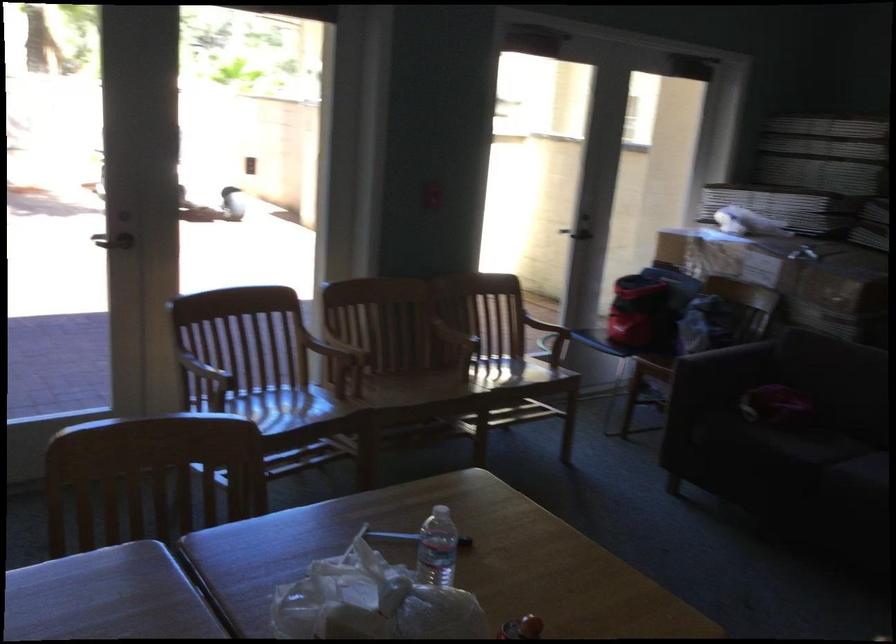
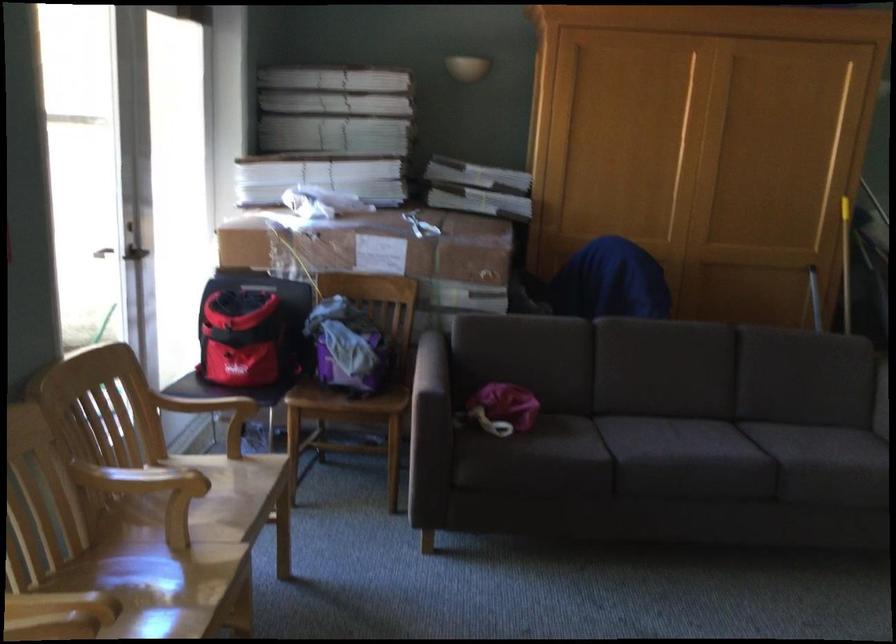
Where in the second image is the point corresponding to (x=773, y=252) from the first image?

(371, 245)